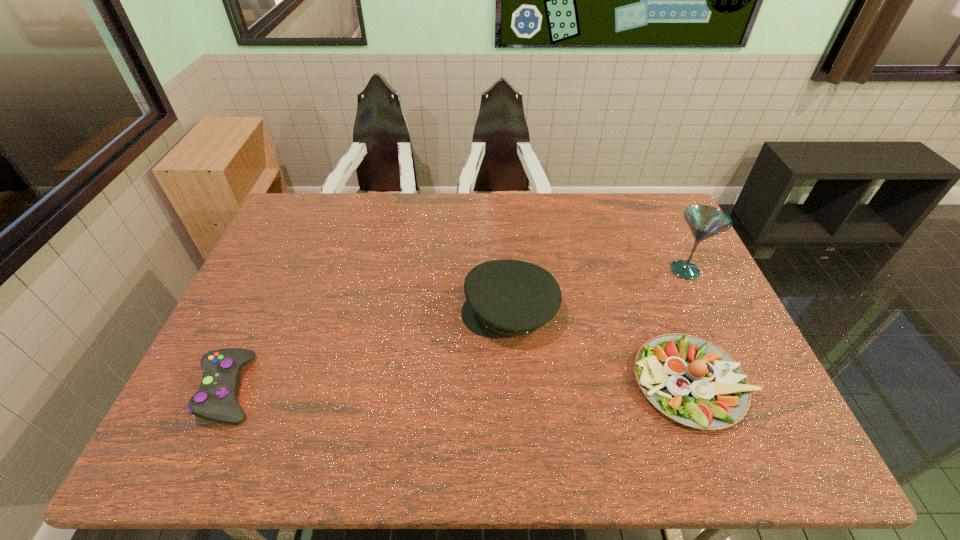
Where is `free area in between the beret and the tallest object`? free area in between the beret and the tallest object is located at coordinates (597, 291).

Locate an element on the screen. Image resolution: width=960 pixels, height=540 pixels. blank region between the salad plate and the tallest object is located at coordinates (688, 327).

Identify the location of free space that is in between the leftmost object and the martini. This screenshot has width=960, height=540. (458, 329).

Image resolution: width=960 pixels, height=540 pixels. In order to click on free space between the tallest object and the shortest object in this screenshot , I will do `click(458, 329)`.

Where is `the second closest object relative to the salad plate`? Image resolution: width=960 pixels, height=540 pixels. the second closest object relative to the salad plate is located at coordinates (704, 221).

Select which object is the closest to the salad plate. Please provide its 2D coordinates. Your answer should be formatted as a tuple, i.e. [(x, y)], where the tuple contains the x and y coordinates of a point satisfying the conditions above.

[(505, 298)]

Where is `vacant region that satisfies the following two spatial constraints: 1. on the front side of the martini; 2. on the front-facing side of the beret`? vacant region that satisfies the following two spatial constraints: 1. on the front side of the martini; 2. on the front-facing side of the beret is located at coordinates (705, 313).

At what (x,y) coordinates should I click in order to perform the action: click on vacant area in the image that satisfies the following two spatial constraints: 1. on the back side of the tallest object; 2. on the right side of the salad plate. Please return your answer as a coordinate pair (x, y). This screenshot has width=960, height=540. Looking at the image, I should click on (648, 270).

Image resolution: width=960 pixels, height=540 pixels. I want to click on free region that satisfies the following two spatial constraints: 1. on the front-facing side of the salad plate; 2. on the left side of the third shortest object, so click(514, 383).

Find the location of a particular element. The image size is (960, 540). vacant point that satisfies the following two spatial constraints: 1. on the front-facing side of the second tallest object; 2. on the front side of the control is located at coordinates (515, 388).